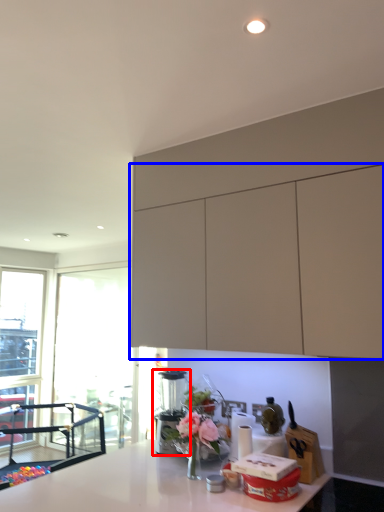
Question: Which of the following is the closest to the observer, coffee machine (highlighted by a red box) or cabinetry (highlighted by a blue box)?

Choices:
 (A) coffee machine
 (B) cabinetry

Answer: (B)